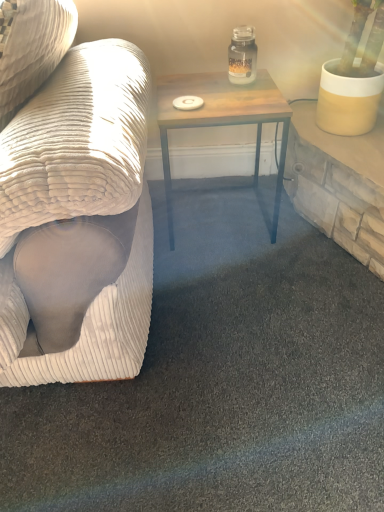
Question: Visually, is white corduroy couch at left positioned to the left or to the right of wooden table at center?

Choices:
 (A) right
 (B) left

Answer: (B)

Question: Is white corduroy couch at left in front of or behind wooden table at center in the image?

Choices:
 (A) behind
 (B) front

Answer: (B)

Question: Which object is positioned closest to the clear glass jar at upper center?

Choices:
 (A) wooden table at center
 (B) white corduroy couch at left

Answer: (A)

Question: Which object is the farthest from the white corduroy couch at left?

Choices:
 (A) wooden table at center
 (B) clear glass jar at upper center

Answer: (B)